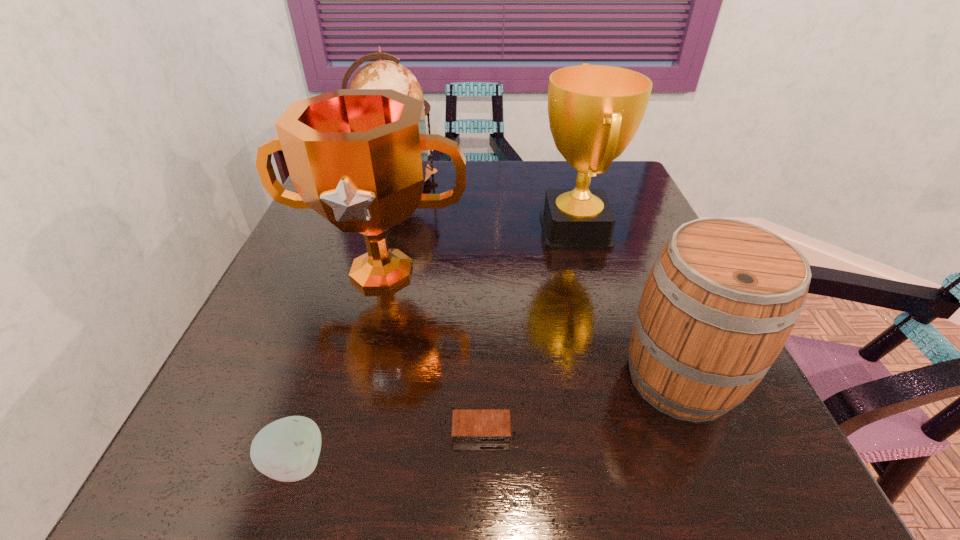
Locate an element on the screen. The height and width of the screenshot is (540, 960). apple located at the left edge is located at coordinates (287, 450).

Image resolution: width=960 pixels, height=540 pixels. I want to click on award positioned at the right edge, so click(x=594, y=111).

The width and height of the screenshot is (960, 540). What are the coordinates of `cider at the right edge` in the screenshot? It's located at (723, 295).

Identify the location of object positioned at the far left corner. (382, 74).

Where is `object at the near left corner`? object at the near left corner is located at coordinates (287, 450).

Where is `object located at the far right corner`? The height and width of the screenshot is (540, 960). object located at the far right corner is located at coordinates (594, 111).

Where is `vacant space at the far edge`? vacant space at the far edge is located at coordinates click(449, 167).

You are a GUI agent. You are given a task and a screenshot of the screen. Output one action in this format:
    pyautogui.click(x=<x>, y=<y>)
    Task: Click on the vacant space at the near edge of the desktop
    
    Given the screenshot: What is the action you would take?
    pyautogui.click(x=554, y=482)

In the image, there is a desktop. Where is `free region at the left edge`? This screenshot has width=960, height=540. free region at the left edge is located at coordinates coord(322,284).

This screenshot has width=960, height=540. Find the location of `vacant area at the right edge of the desktop`. vacant area at the right edge of the desktop is located at coordinates (622, 236).